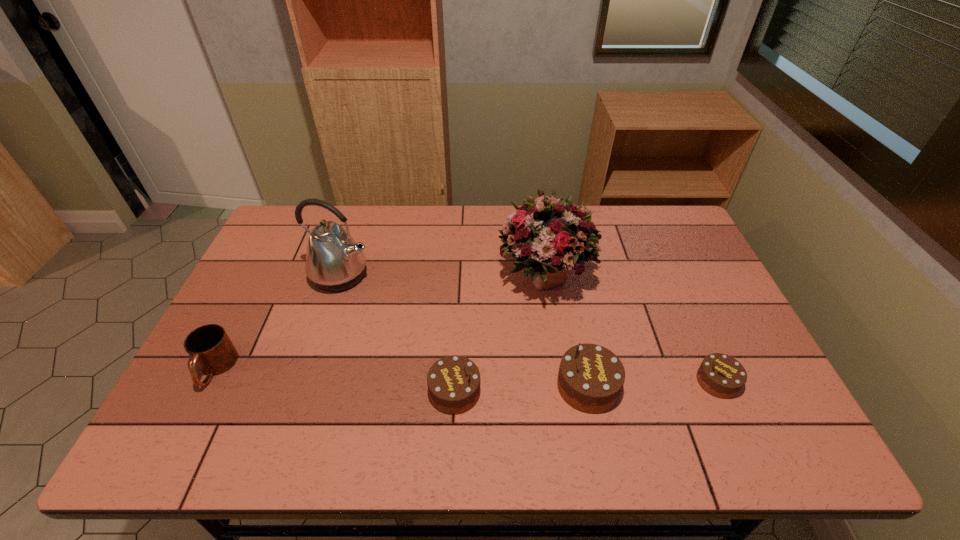
Find the location of a particular element. free space between the fourth object from right to left and the second object from left to right is located at coordinates (397, 334).

The image size is (960, 540). Find the location of `the fourth closest object to the second tallest chocolate cake`. the fourth closest object to the second tallest chocolate cake is located at coordinates (211, 350).

Select which object is the third closest to the shortest object. Please provide its 2D coordinates. Your answer should be formatted as a tuple, i.e. [(x, y)], where the tuple contains the x and y coordinates of a point satisfying the conditions above.

[(453, 382)]

Identify which chocolate cake is located as the second nearest to the shortest chocolate cake. Please provide its 2D coordinates. Your answer should be formatted as a tuple, i.e. [(x, y)], where the tuple contains the x and y coordinates of a point satisfying the conditions above.

[(453, 382)]

Identify the location of the second closest chocolate cake relative to the shortest chocolate cake. (453, 382).

Locate an element on the screen. vacant space that satisfies the following two spatial constraints: 1. on the front side of the second tallest chocolate cake; 2. on the right side of the fifth object from right to left is located at coordinates (303, 392).

Locate an element on the screen. Image resolution: width=960 pixels, height=540 pixels. vacant space that satisfies the following two spatial constraints: 1. on the side of the leftmost object with the handle; 2. on the right side of the rightmost chocolate cake is located at coordinates (208, 381).

This screenshot has height=540, width=960. Find the location of `vacant space that satisfies the following two spatial constraints: 1. on the back side of the tallest chocolate cake; 2. on the right side of the fourth object from right to left`. vacant space that satisfies the following two spatial constraints: 1. on the back side of the tallest chocolate cake; 2. on the right side of the fourth object from right to left is located at coordinates (455, 386).

At what (x,y) coordinates should I click in order to perform the action: click on free space that satisfies the following two spatial constraints: 1. on the front side of the tallest chocolate cake; 2. on the left side of the bouquet. Please return your answer as a coordinate pair (x, y). Looking at the image, I should click on (562, 386).